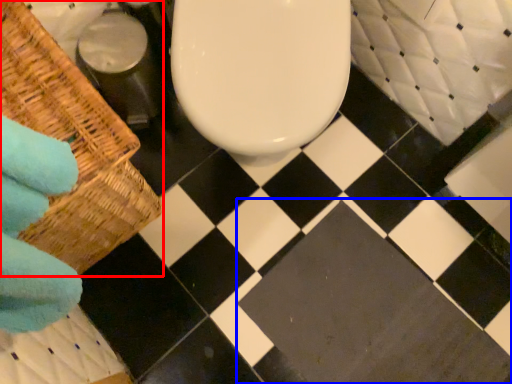
Question: Which point is closer to the camera, basket (highlighted by a red box) or square (highlighted by a blue box)?

Choices:
 (A) basket
 (B) square

Answer: (A)